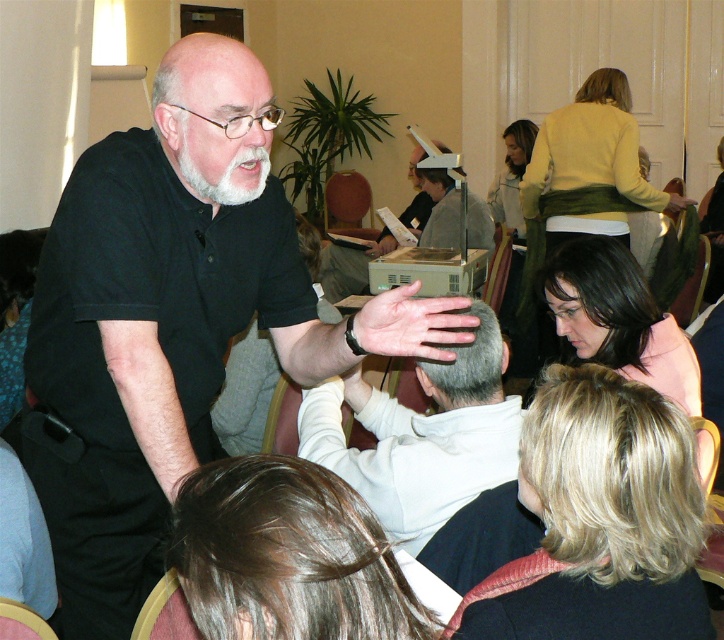
In the scene shown: Does blonde hair at lower right have a greater width compared to white matte shirt at center?

No.

Where is `blonde hair at lower right`? The width and height of the screenshot is (724, 640). blonde hair at lower right is located at coordinates (599, 518).

Which is in front, point (607, 92) or point (599, 241)?

Point (599, 241)

Identify the location of green textured scarf at upper right. (584, 177).

Is white matte shirt at center bigger than green textured scarf at upper right?

No, white matte shirt at center is not bigger than green textured scarf at upper right.

Is white matte shirt at center above green textured scarf at upper right?

Actually, white matte shirt at center is below green textured scarf at upper right.

At what (x,y) coordinates should I click in order to perform the action: click on white matte shirt at center. Please return your answer as a coordinate pair (x, y). Looking at the image, I should click on (421, 436).